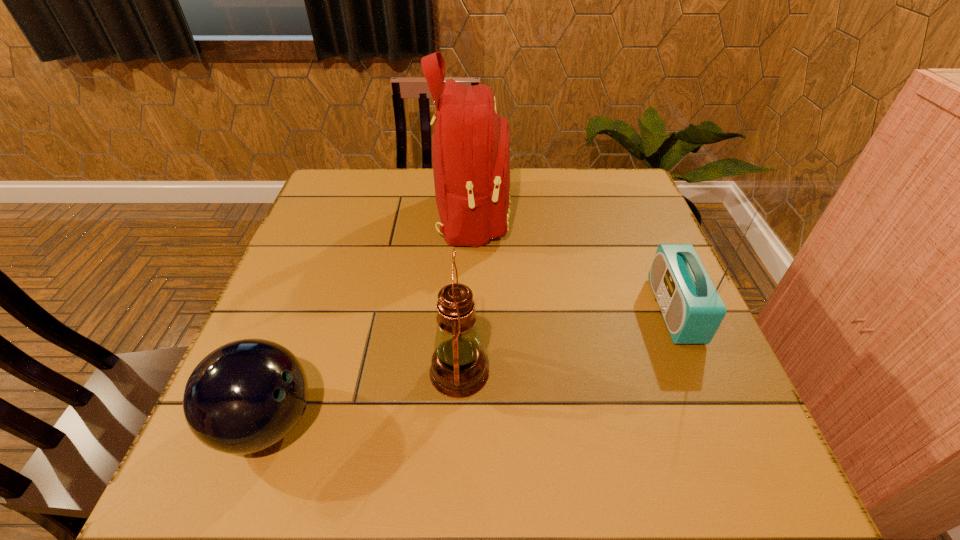
The height and width of the screenshot is (540, 960). I want to click on backpack, so click(x=471, y=144).

Find the location of a particular element. the farthest object is located at coordinates (471, 144).

At what (x,y) coordinates should I click in order to perform the action: click on radio receiver. Please return your answer as a coordinate pair (x, y). The height and width of the screenshot is (540, 960). Looking at the image, I should click on (693, 310).

You are a GUI agent. You are given a task and a screenshot of the screen. Output one action in this format:
    pyautogui.click(x=<x>, y=<y>)
    Task: Click on the oil lamp
    
    Given the screenshot: What is the action you would take?
    pyautogui.click(x=459, y=369)

This screenshot has width=960, height=540. Identify the location of the shortest object. (245, 396).

The image size is (960, 540). In order to click on bowling ball in this screenshot , I will do `click(245, 396)`.

Image resolution: width=960 pixels, height=540 pixels. What are the coordinates of `free space located on the front-facing side of the backpack` in the screenshot? It's located at (552, 217).

This screenshot has height=540, width=960. In order to click on vacant region located 0.260m on the front panel of the rightmost object in this screenshot , I will do `click(540, 310)`.

I want to click on free spot located 0.060m on the front panel of the rightmost object, so click(629, 310).

Locate an element on the screen. This screenshot has width=960, height=540. vacant space situated 0.080m on the front panel of the rightmost object is located at coordinates (619, 310).